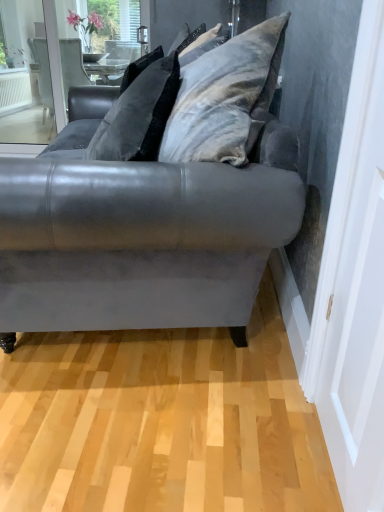
Question: Choose the correct answer: Is velvet gray pillow at upper center inside velvet gray couch at center or outside it?

Choices:
 (A) outside
 (B) inside

Answer: (B)

Question: From a real-world perspective, is velvet gray pillow at upper center positioned above or below velvet gray couch at center?

Choices:
 (A) above
 (B) below

Answer: (A)

Question: Estimate the real-world distances between objects in this image. Which object is farther from the matte gray screen door at right?

Choices:
 (A) velvet gray couch at center
 (B) velvet gray pillow at upper center

Answer: (B)

Question: Based on their relative distances, which object is nearer to the velvet gray pillow at upper center?

Choices:
 (A) velvet gray couch at center
 (B) matte gray screen door at right

Answer: (A)